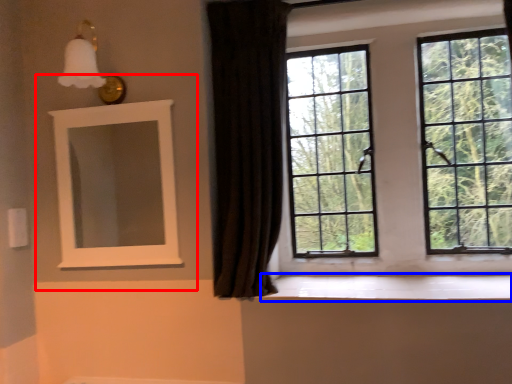
Question: Which of the following is the farthest to the observer, medicine cabinet (highlighted by a red box) or window sill (highlighted by a blue box)?

Choices:
 (A) medicine cabinet
 (B) window sill

Answer: (A)